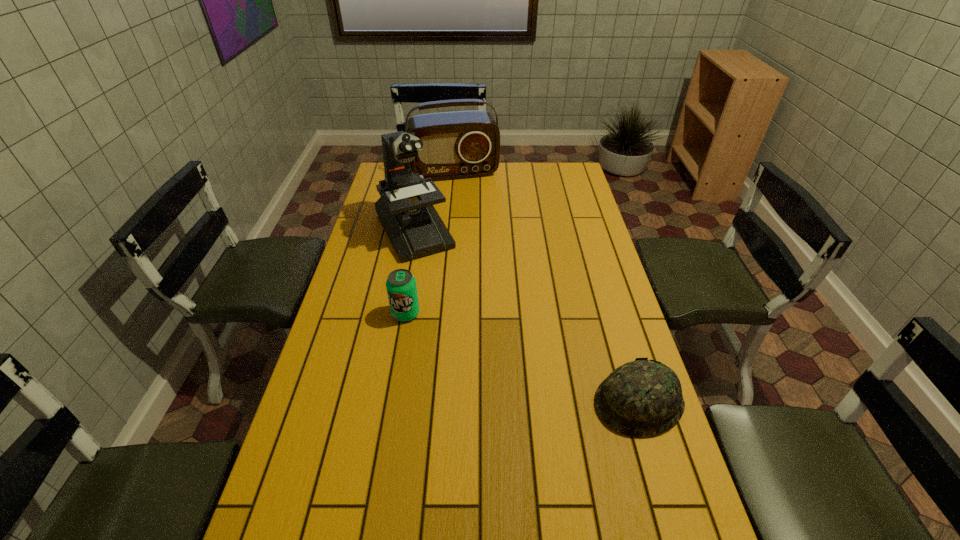
Locate an element on the screen. the second shortest object is located at coordinates (401, 287).

At what (x,y) coordinates should I click in order to perform the action: click on pop soda. Please return your answer as a coordinate pair (x, y). Looking at the image, I should click on (401, 287).

Locate an element on the screen. The height and width of the screenshot is (540, 960). headwear is located at coordinates (641, 398).

Identify the location of the shortest object. The height and width of the screenshot is (540, 960). (641, 398).

Locate an element on the screen. This screenshot has height=540, width=960. the third nearest object is located at coordinates (405, 209).

You are a GUI agent. You are given a task and a screenshot of the screen. Output one action in this format:
    pyautogui.click(x=<x>, y=<y>)
    Task: Click on the microscope
    
    Given the screenshot: What is the action you would take?
    pyautogui.click(x=405, y=209)

Identify the location of the farthest object. (462, 144).

Where is `the third shortest object`? Image resolution: width=960 pixels, height=540 pixels. the third shortest object is located at coordinates (462, 144).

The height and width of the screenshot is (540, 960). In order to click on vacant region located 0.370m on the front-facing side of the second shortest object in this screenshot , I will do `click(384, 438)`.

Locate an element on the screen. The width and height of the screenshot is (960, 540). free space located 0.350m on the left of the shortest object is located at coordinates (458, 402).